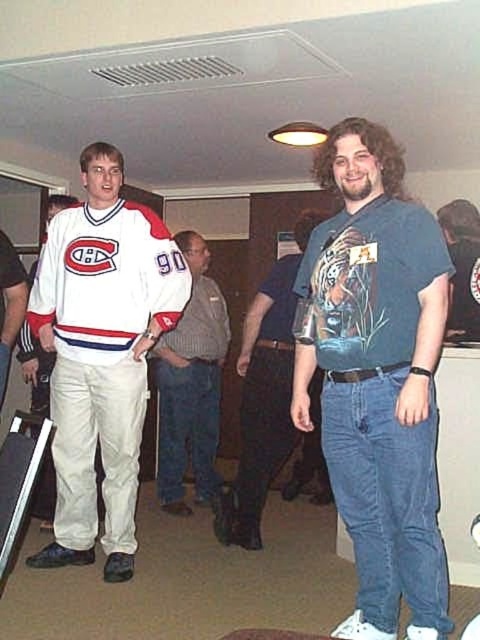
Is blue denim jeans at center shorter than gray knit sweater at center?

Incorrect, blue denim jeans at center's height does not fall short of gray knit sweater at center's.

Is blue denim jeans at center further to the viewer compared to gray knit sweater at center?

No.

Describe the element at coordinates (376, 378) in the screenshot. Image resolution: width=480 pixels, height=640 pixels. I see `blue denim jeans at center` at that location.

What are the coordinates of `blue denim jeans at center` in the screenshot? It's located at (376, 378).

Where is `blue denim jeans at center`? This screenshot has width=480, height=640. blue denim jeans at center is located at coordinates (376, 378).

Who is taller, blue denim jeans at center or white jersey at center?

white jersey at center is taller.

Is point (343, 369) closer to viewer compared to point (104, 204)?

Yes, point (343, 369) is closer to viewer.

Locate an element on the screen. The height and width of the screenshot is (640, 480). blue denim jeans at center is located at coordinates (376, 378).

Which is behind, point (387, 205) or point (261, 364)?

Point (261, 364)

Is blue denim jeans at center positioned before blue printed t-shirt at center?

Yes, blue denim jeans at center is in front of blue printed t-shirt at center.

Which is behind, point (382, 250) or point (276, 268)?

Point (276, 268)

At what (x,y) coordinates should I click in order to perform the action: click on blue denim jeans at center. Please return your answer as a coordinate pair (x, y). Looking at the image, I should click on (376, 378).